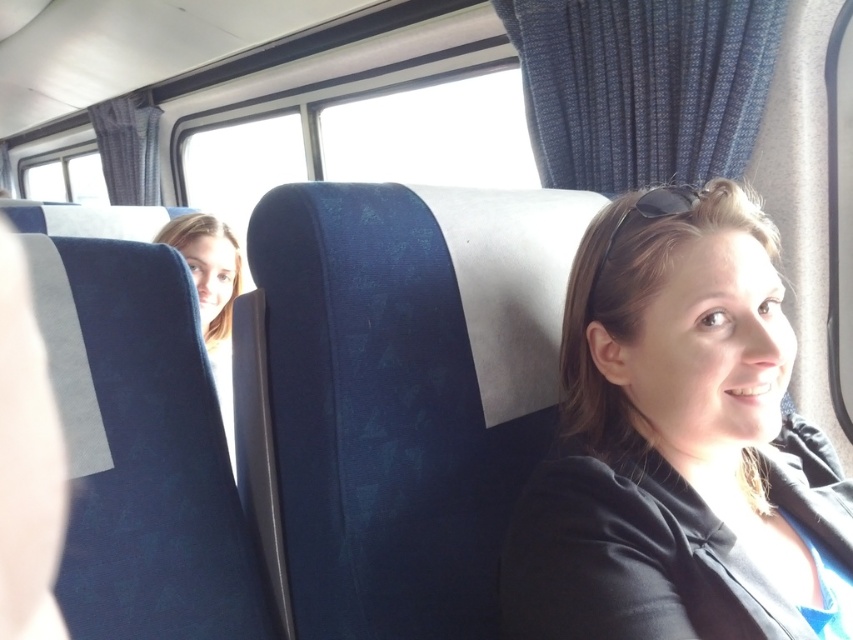
You are a passenger on a bus and want to know if the matte black jacket at center is blocking the view of the blonde hair at upper left. Can you determine this based on their positions?

The matte black jacket at center is in front of blonde hair at upper left, so it is blocking the view of the blonde hair at upper left.

Consider the image. You are a delivery robot with a 2.5 feet wide package. You need to move from the front of the bus to the back. Can you pass between the matte black jacket at center and the blonde hair at upper left without tilting the package?

The distance between the matte black jacket at center and the blonde hair at upper left is 3.40 feet, which is wider than the 2.5 feet wide package. Therefore, the delivery robot can pass through without tilting the package.

From the picture: You are a passenger on a bus and you see a person with blonde hair at upper left and sunglasses at center. Which object is located higher in the image?

The sunglasses at center are located higher in the image than the blonde hair at upper left.